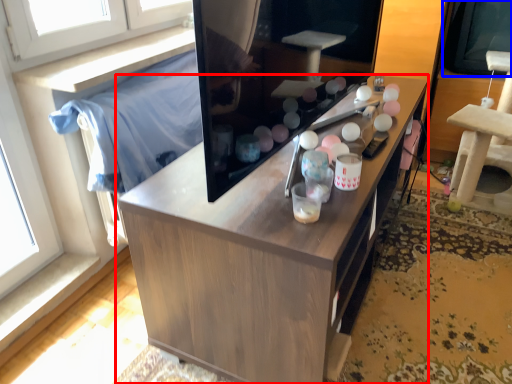
Question: Which point is closer to the camera, cabinetry (highlighted by a red box) or window screen (highlighted by a blue box)?

Choices:
 (A) cabinetry
 (B) window screen

Answer: (A)